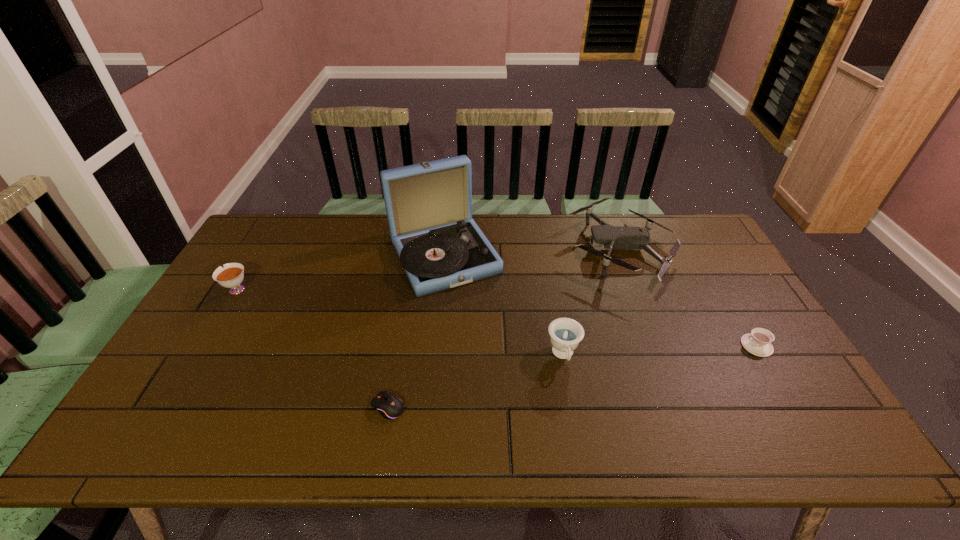
Image resolution: width=960 pixels, height=540 pixels. In the image, there is a desktop. In order to click on vacant space at the far right corner in this screenshot , I will do `click(669, 246)`.

Identify the location of vacant space that is in between the tallest object and the drone. This screenshot has height=540, width=960. (532, 253).

This screenshot has width=960, height=540. What are the coordinates of `empty space that is in between the nearest object and the rightmost object` in the screenshot? It's located at (572, 376).

This screenshot has height=540, width=960. Identify the location of free space between the fourth object from left to right and the nearest object. (476, 381).

You are a GUI agent. You are given a task and a screenshot of the screen. Output one action in this format:
    pyautogui.click(x=<x>, y=<y>)
    Task: Click on the free space between the rightmost object and the drone
    
    Given the screenshot: What is the action you would take?
    tap(688, 297)

Identify the location of vacant region between the second teacup from left to right and the phonograph record. The width and height of the screenshot is (960, 540). (504, 306).

Locate an element on the screen. vacant space that's between the phonograph record and the second shortest object is located at coordinates (601, 301).

You are a GUI agent. You are given a task and a screenshot of the screen. Output one action in this format:
    pyautogui.click(x=<x>, y=<y>)
    Task: Click on the vacant area between the leftmost object and the nearest object
    The height and width of the screenshot is (540, 960).
    Given the screenshot: What is the action you would take?
    [x=312, y=348]

Locate an element on the screen. The height and width of the screenshot is (540, 960). vacant area between the second teacup from right to left and the shortest object is located at coordinates (476, 381).

Identify the location of free spot between the farthest teacup and the second teacup from right to left. (399, 322).